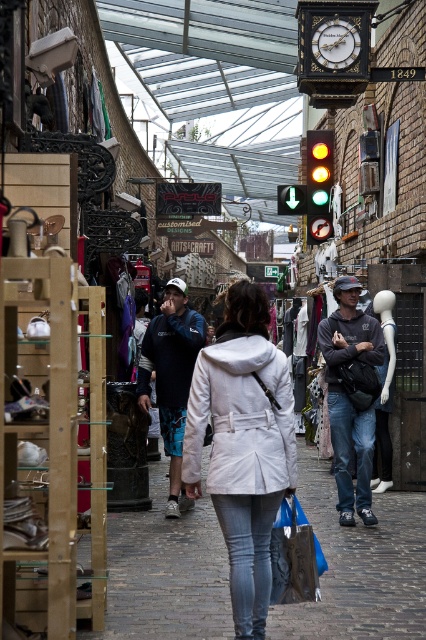
Between point (368, 513) and point (305, 554), which one is positioned behind?

The point (368, 513) is more distant.

Is matte gray hoodie at center thinner than blue fabric bag at center?

No.

Find the location of a particular element. The width and height of the screenshot is (426, 640). matte gray hoodie at center is located at coordinates [x=348, y=397].

Who is positioned more to the left, denim jeans at center or white matte coat at center?

Positioned to the left is white matte coat at center.

Is point (394, 595) positioned after point (255, 534)?

That is True.

Does point (351, 620) lie in front of point (247, 554)?

No, (351, 620) is further to viewer.

Find the location of a particular element. This screenshot has height=640, width=426. denim jeans at center is located at coordinates (359, 566).

Which is more to the right, denim jeans at center or gold polished clock at upper center?

gold polished clock at upper center is more to the right.

Describe the element at coordinates (359, 566) in the screenshot. I see `denim jeans at center` at that location.

Where is `denim jeans at center`? The image size is (426, 640). denim jeans at center is located at coordinates pos(359,566).